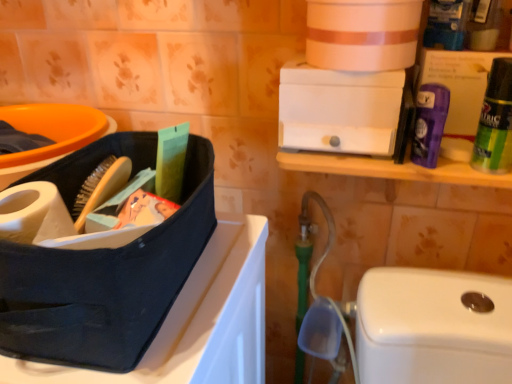
I want to click on vacant space that is to the left of green matte fabric softener at upper right, positioned as the first cleaning product in right-to-left order, so click(x=382, y=158).